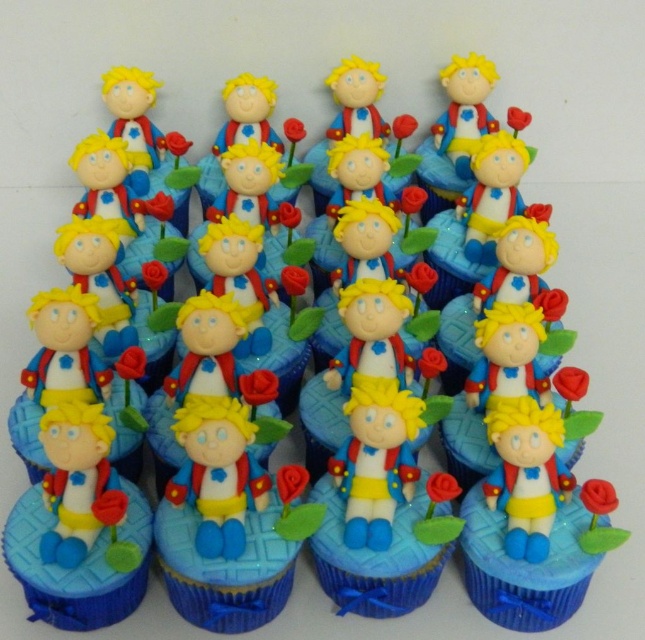
Question: Observing the image, what is the correct spatial positioning of matte blue cupcake at center in reference to matte plastic figurine at center?

Choices:
 (A) left
 (B) right

Answer: (B)

Question: Is matte blue cupcake at center positioned in front of matte plastic figurine at center?

Choices:
 (A) no
 (B) yes

Answer: (A)

Question: Is matte blue cupcake at center thinner than matte plastic figurine at center?

Choices:
 (A) yes
 (B) no

Answer: (B)